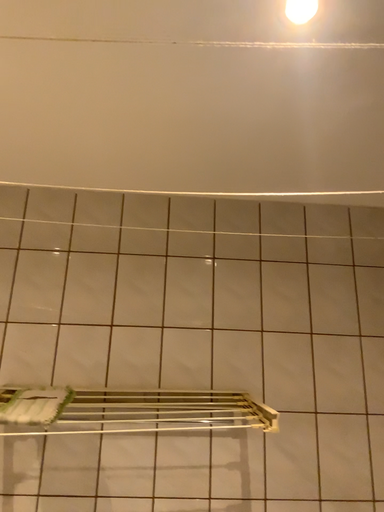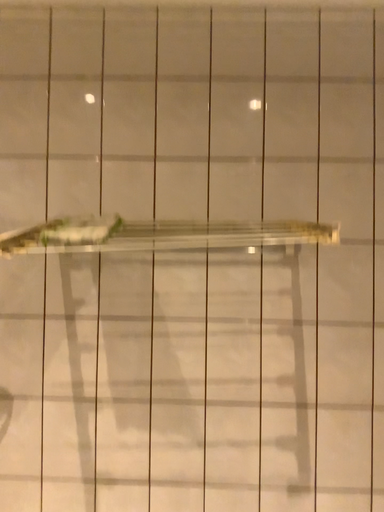
Question: How did the camera likely rotate when shooting the video?

Choices:
 (A) rotated downward
 (B) rotated upward

Answer: (A)